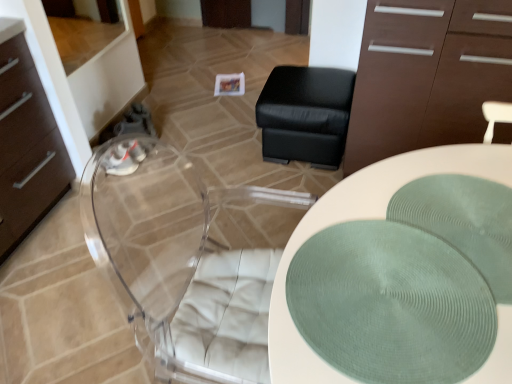
Question: Is black leather ottoman at center facing towards green textured placemat at center?

Choices:
 (A) no
 (B) yes

Answer: (B)

Question: Does black leather ottoman at center have a lesser height compared to green textured placemat at center?

Choices:
 (A) yes
 (B) no

Answer: (B)

Question: Is black leather ottoman at center further to camera compared to green textured placemat at center?

Choices:
 (A) no
 (B) yes

Answer: (B)

Question: From a real-world perspective, is black leather ottoman at center below green textured placemat at center?

Choices:
 (A) no
 (B) yes

Answer: (B)

Question: Is black leather ottoman at center positioned far away from green textured placemat at center?

Choices:
 (A) no
 (B) yes

Answer: (B)

Question: Is black leather ottoman at center next to green textured placemat at center?

Choices:
 (A) yes
 (B) no

Answer: (B)

Question: Is white textured placemat at center oriented away from transparent acrylic swivel chair at center?

Choices:
 (A) no
 (B) yes

Answer: (A)

Question: Could you tell me if white textured placemat at center is turned towards transparent acrylic swivel chair at center?

Choices:
 (A) yes
 (B) no

Answer: (B)

Question: From the image's perspective, is white textured placemat at center on top of transparent acrylic swivel chair at center?

Choices:
 (A) yes
 (B) no

Answer: (B)

Question: Considering the relative positions of white textured placemat at center and transparent acrylic swivel chair at center in the image provided, is white textured placemat at center to the right of transparent acrylic swivel chair at center from the viewer's perspective?

Choices:
 (A) no
 (B) yes

Answer: (B)

Question: Is white textured placemat at center not within transparent acrylic swivel chair at center?

Choices:
 (A) yes
 (B) no

Answer: (A)

Question: Considering the relative sizes of white textured placemat at center and transparent acrylic swivel chair at center in the image provided, is white textured placemat at center smaller than transparent acrylic swivel chair at center?

Choices:
 (A) no
 (B) yes

Answer: (A)

Question: Does black leather ottoman at center appear on the left side of white textured placemat at center?

Choices:
 (A) no
 (B) yes

Answer: (B)